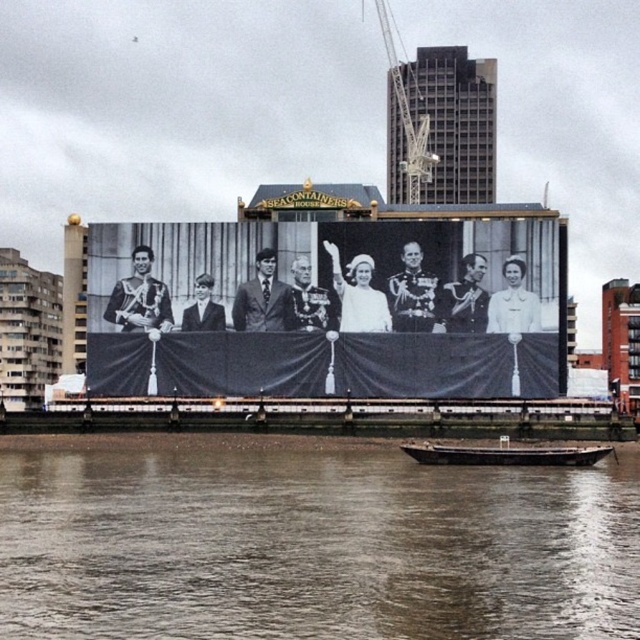
You are a photographer trying to capture the rusty metal barge at lower center and the metallic gray crane at upper center in the same frame. Based on their positions, will the crane be visible behind the barge?

Yes, the rusty metal barge at lower center is in front of the metallic gray crane at upper center, so the crane will be visible behind the barge in your photo.

You are a photographer planning to take a wide shot of the brown water at lower center and the rusty metal barge at lower center. Based on their sizes, which one will occupy more space in your photo?

The brown water at lower center occupies more space in the photo because it is larger in size than the rusty metal barge at lower center.

You are standing at the shoreline near the anchored boat and want to take a photo of the black and white photograph at center. Which direction should you face to ensure the photograph is in your view?

The black and white photograph at center is located at point (326, 308), which is near the center of the scene. Since you are at the shoreline with the anchored boat, facing towards the center of the scene would allow you to capture the photograph in your view.